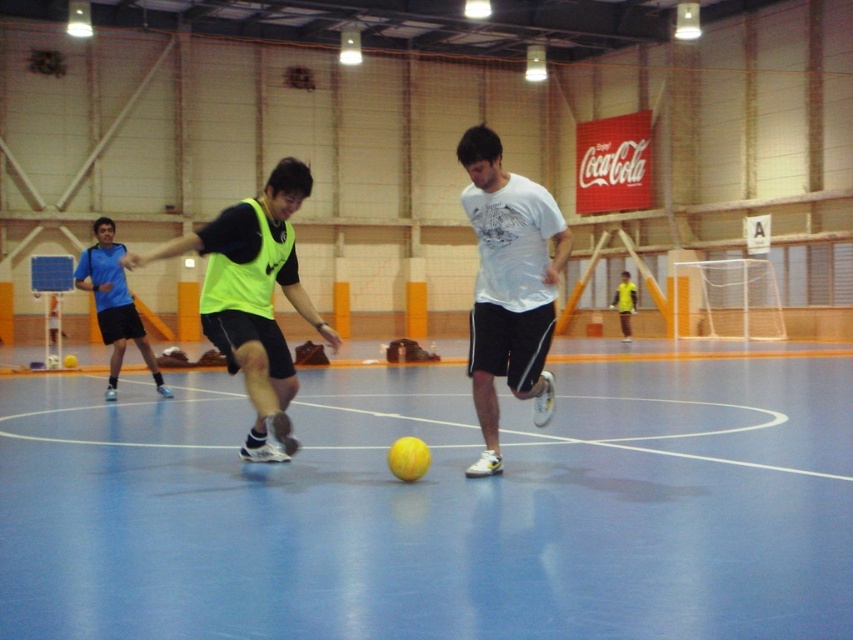
Question: Can you confirm if neon yellow vest at center is positioned below neon yellow jersey at center?

Choices:
 (A) yes
 (B) no

Answer: (A)

Question: Is neon yellow vest at center bigger than neon yellow jersey at center?

Choices:
 (A) no
 (B) yes

Answer: (A)

Question: Based on their relative distances, which object is farther from the neon yellow vest at center?

Choices:
 (A) yellow matte shirt at center
 (B) white matte t-shirt at center

Answer: (A)

Question: Which object appears farthest from the camera in this image?

Choices:
 (A) neon yellow vest at center
 (B) yellow matte shirt at center
 (C) white matte t-shirt at center

Answer: (B)

Question: Is neon yellow jersey at center wider than yellow matte shirt at center?

Choices:
 (A) no
 (B) yes

Answer: (A)

Question: Which of these objects is positioned closest to the yellow matte shirt at center?

Choices:
 (A) neon yellow jersey at center
 (B) white matte t-shirt at center

Answer: (A)